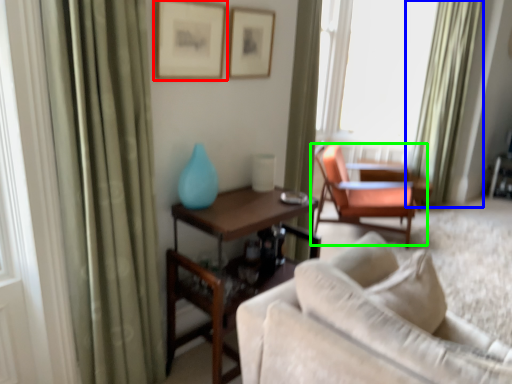
Question: Estimate the real-world distances between objects in this image. Which object is farther from picture frame (highlighted by a red box), curtain (highlighted by a blue box) or chair (highlighted by a green box)?

Choices:
 (A) curtain
 (B) chair

Answer: (A)